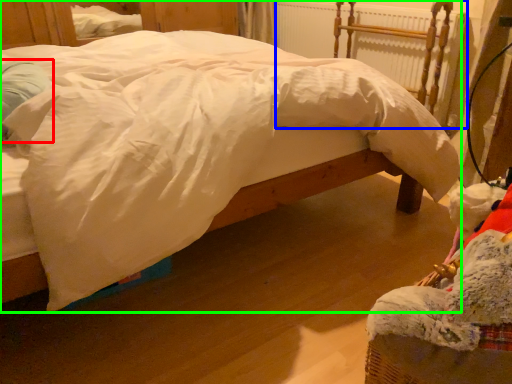
Question: Which object is positioned farthest from pillow (highlighted by a red box)? Select from radiator (highlighted by a blue box) and bed (highlighted by a green box).

Choices:
 (A) radiator
 (B) bed

Answer: (A)